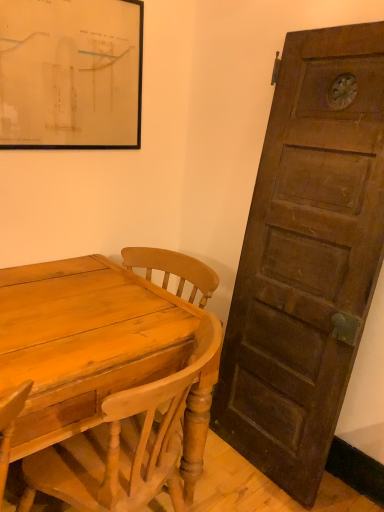
The image size is (384, 512). What do you see at coordinates (135, 442) in the screenshot?
I see `light brown wood chair at center` at bounding box center [135, 442].

Where is `light brown wood chair at center`? Image resolution: width=384 pixels, height=512 pixels. light brown wood chair at center is located at coordinates (135, 442).

Image resolution: width=384 pixels, height=512 pixels. In order to click on light brown wood chair at center in this screenshot , I will do `click(135, 442)`.